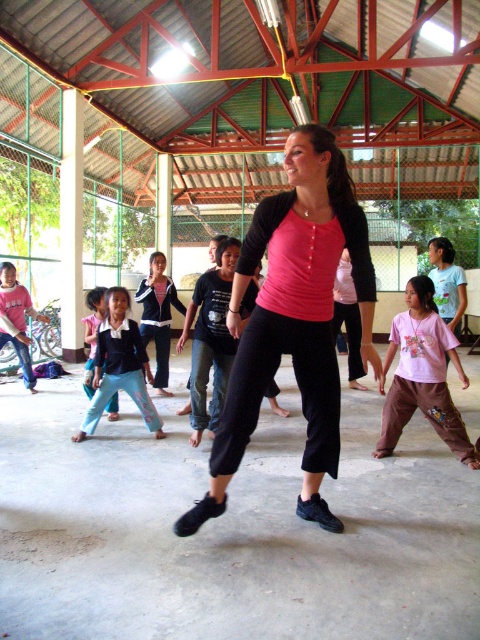
Which is more to the left, blue cotton pants at center or light blue cotton pants at lower left?

Positioned to the left is light blue cotton pants at lower left.

Can you confirm if blue cotton pants at center is wider than light blue cotton pants at lower left?

Indeed, blue cotton pants at center has a greater width compared to light blue cotton pants at lower left.

Where is `blue cotton pants at center`? blue cotton pants at center is located at coordinates (120, 365).

Is pink matte shirt at center further to the viewer compared to pink cotton shirt at center?

No, pink matte shirt at center is in front of pink cotton shirt at center.

Can you confirm if pink matte shirt at center is positioned above pink cotton shirt at center?

Yes, pink matte shirt at center is above pink cotton shirt at center.

Where is `pink matte shirt at center`? pink matte shirt at center is located at coordinates (294, 317).

At what (x,y) coordinates should I click in order to perform the action: click on pink matte shirt at center. Please return your answer as a coordinate pair (x, y). The image size is (480, 640). Looking at the image, I should click on (294, 317).

Is pink cotton shirt at center positioned in front of light blue cotton pants at lower left?

That is True.

What do you see at coordinates (421, 376) in the screenshot? I see `pink cotton shirt at center` at bounding box center [421, 376].

Where is `pink cotton shirt at center`? The height and width of the screenshot is (640, 480). pink cotton shirt at center is located at coordinates (421, 376).

What are the coordinates of `pink cotton shirt at center` in the screenshot? It's located at (421, 376).